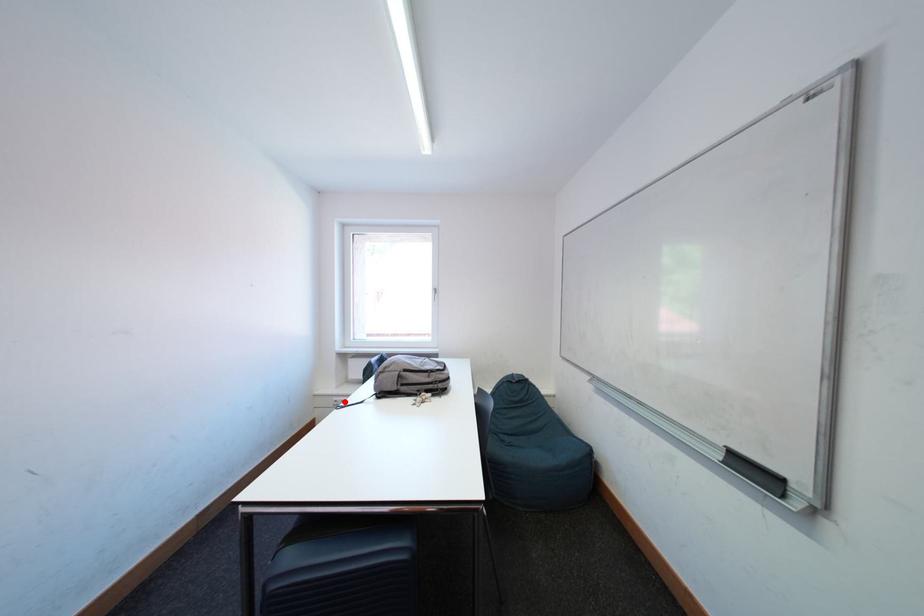
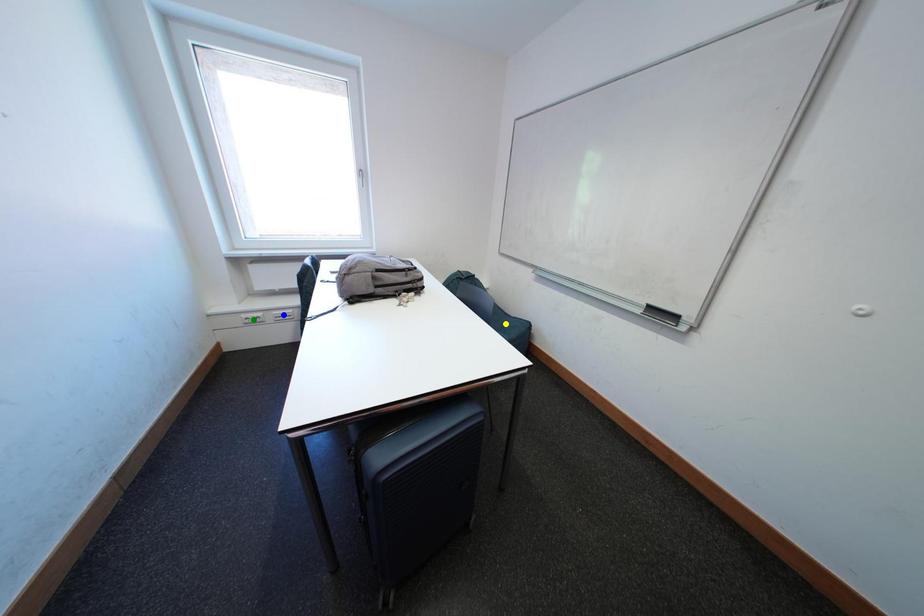
Question: I am providing you with two images of the same scene from different viewpoints. A red point is marked on the first image. You are given multiple points on the second image. Can you choose the point in image 2 that corresponds to the point in image 1?

Choices:
 (A) blue point
 (B) green point
 (C) yellow point

Answer: (B)